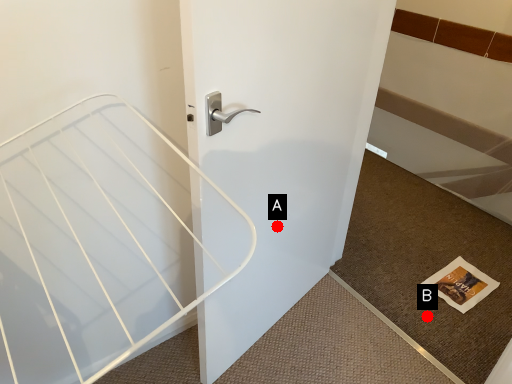
Question: Two points are circled on the image, labeled by A and B beside each circle. Which point is closer to the camera taking this photo?

Choices:
 (A) A is closer
 (B) B is closer

Answer: (A)